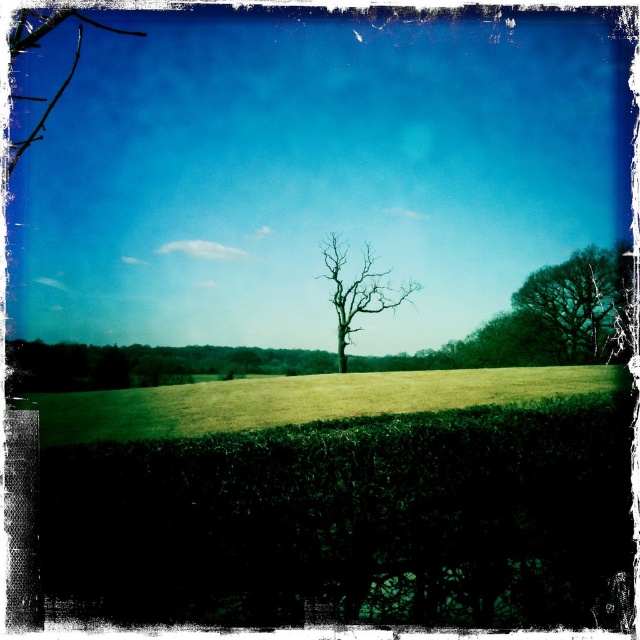
You are a gardener standing in the green grassy field at center and want to water the bare wood tree at center. Since you have a hose that can reach 5 meters, can you water the tree from your current position?

The green grassy field at center is closer to the viewer than the bare wood tree at center, so the distance between them is more than 5 meters. Therefore, the hose cannot reach the tree from the current position.

You are a photographer standing in the rural landscape scene. You want to take a photo that includes both the green grassy field at center and the green leafy tree at upper right. Based on their positions, which object will appear larger in the photo?

The green grassy field at center will appear larger in the photo because it is closer to the viewer than the green leafy tree at upper right.

You are a gardener planning to plant a new tree in this landscape. Considering the height of the green leafy hedge at lower center and the bare wood tree at center, which one is taller?

The green leafy hedge at lower center is taller than the bare wood tree at center according to the description.